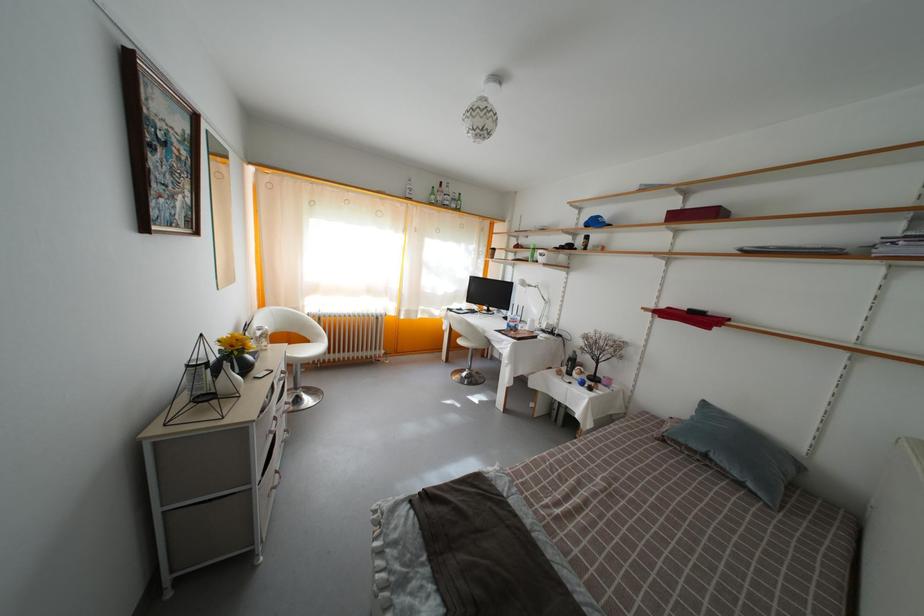
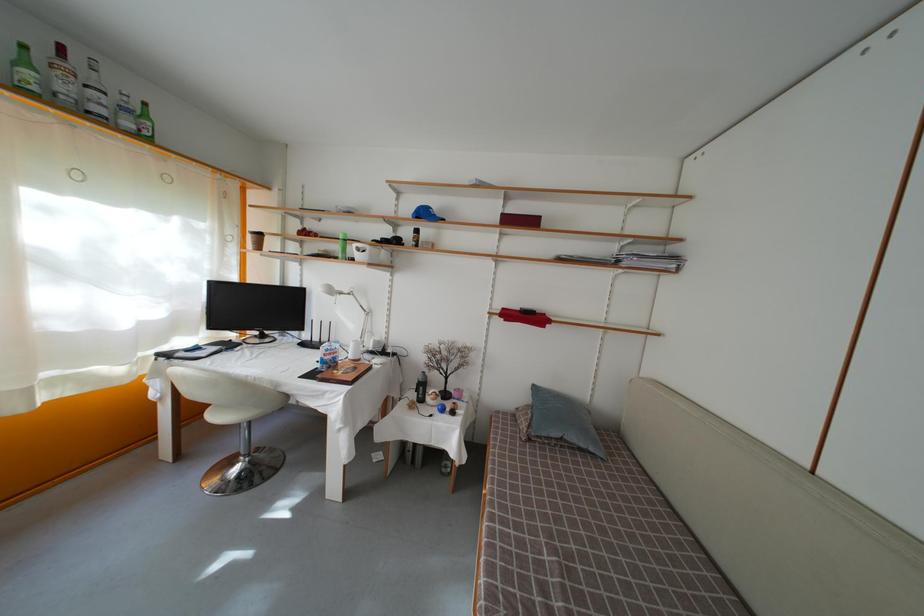
In the second image, find the point that corresponds to (x=545, y=265) in the first image.

(363, 262)